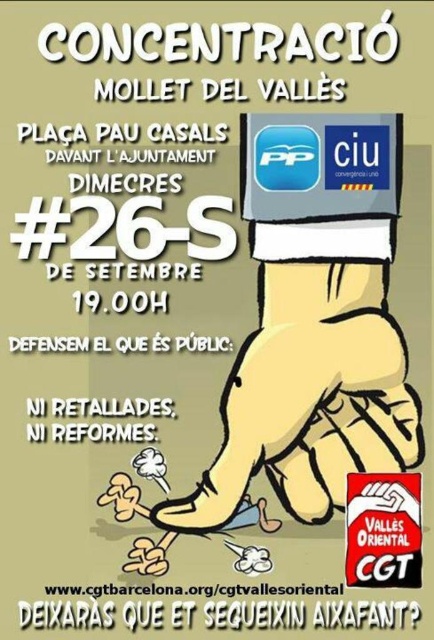
Based on the scene described, which object is positioned to the right of the other? The yellow cartoon hand at center or the red rubber stamp at lower right?

The red rubber stamp at lower right is positioned to the right of the yellow cartoon hand at center.

You are an artist reviewing this political poster. The yellow cartoon hand at center and the red rubber stamp at lower right are part of the central graphic. Which object is taller in the image?

The yellow cartoon hand at center is much taller as the red rubber stamp at lower right.

You are an artist analyzing the poster. You notice the yellow cartoon hand at center and the red rubber stamp at lower right. Which object appears closer to the viewer?

The yellow cartoon hand at center appears closer to the viewer because the red rubber stamp at lower right is behind it.